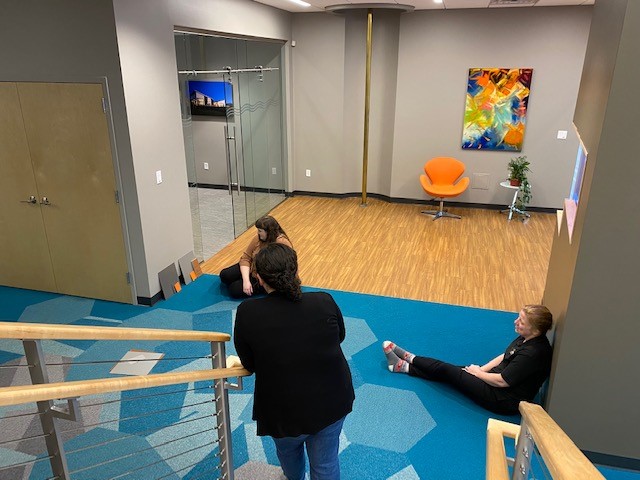
Where is `orange chair`? orange chair is located at coordinates (445, 177).